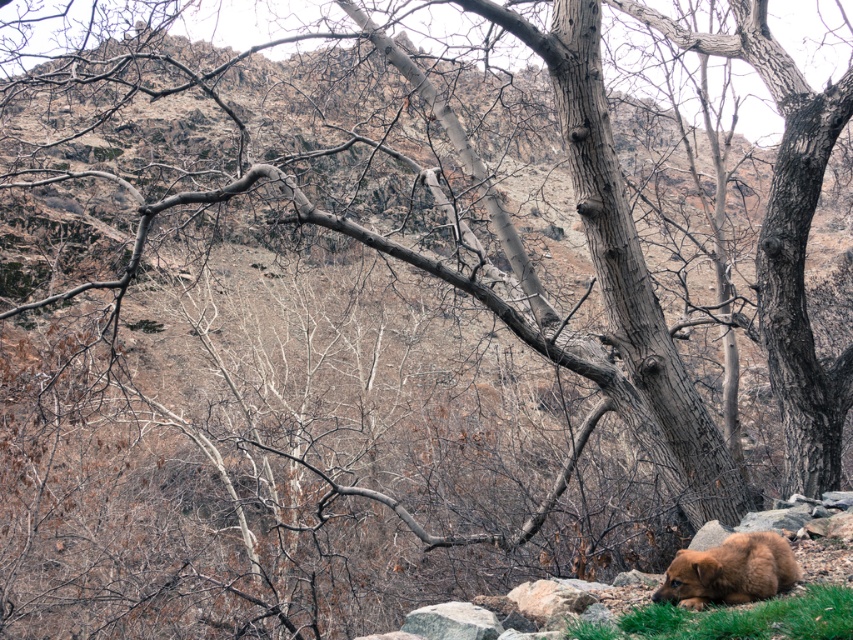
You are a photographer aiming to capture both the green soft grass at lower right and the brown furry bear at lower right in a single frame. Based on their positions, which object will occupy more horizontal space in the photo?

The green soft grass at lower right will occupy more horizontal space in the photo since its width surpasses that of the brown furry bear at lower right.